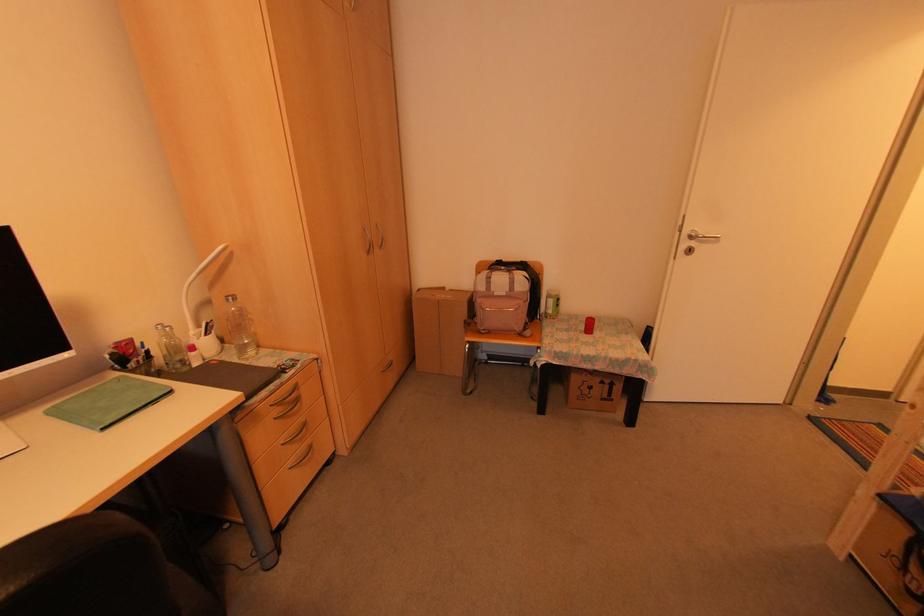
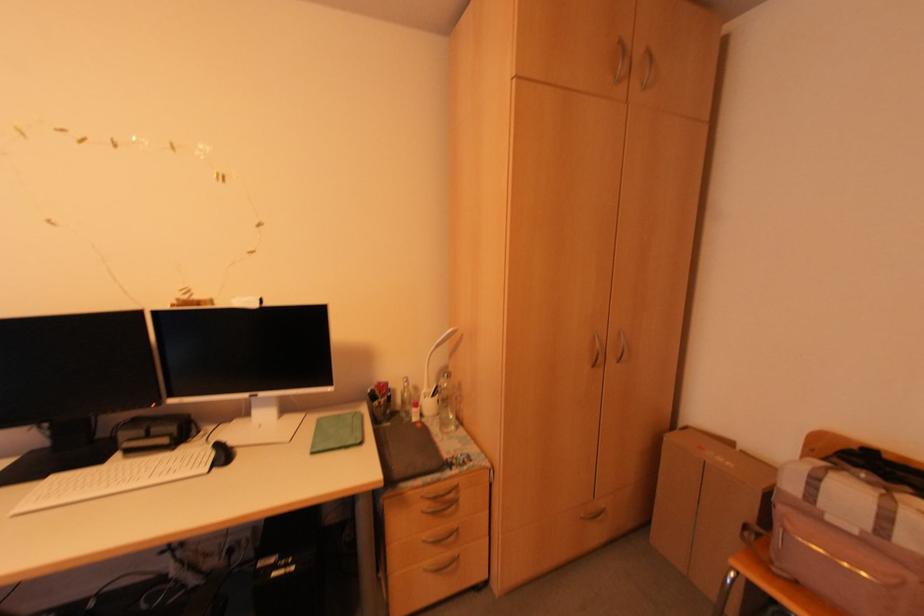
Find the pixel in the second image that matches point (441, 289) in the first image.

(728, 444)